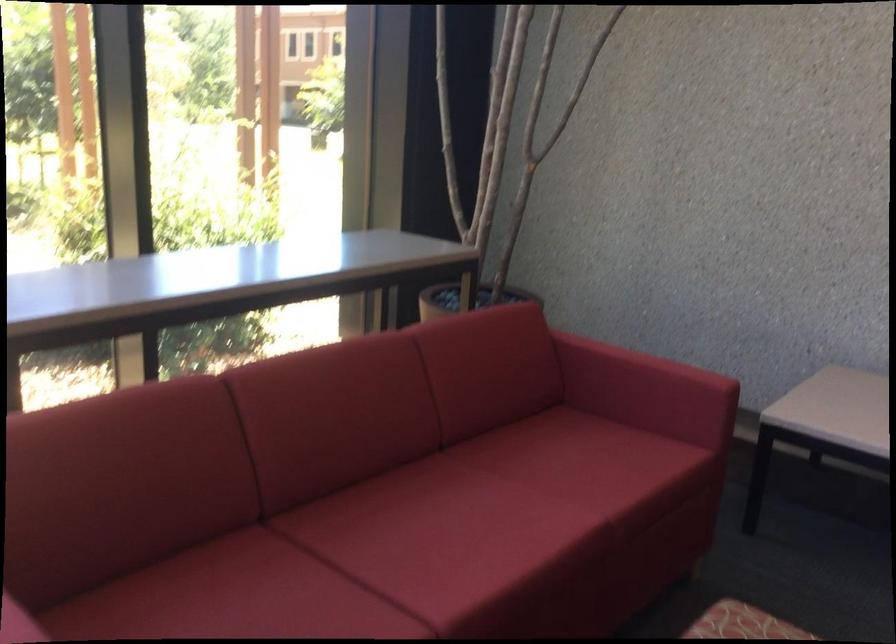
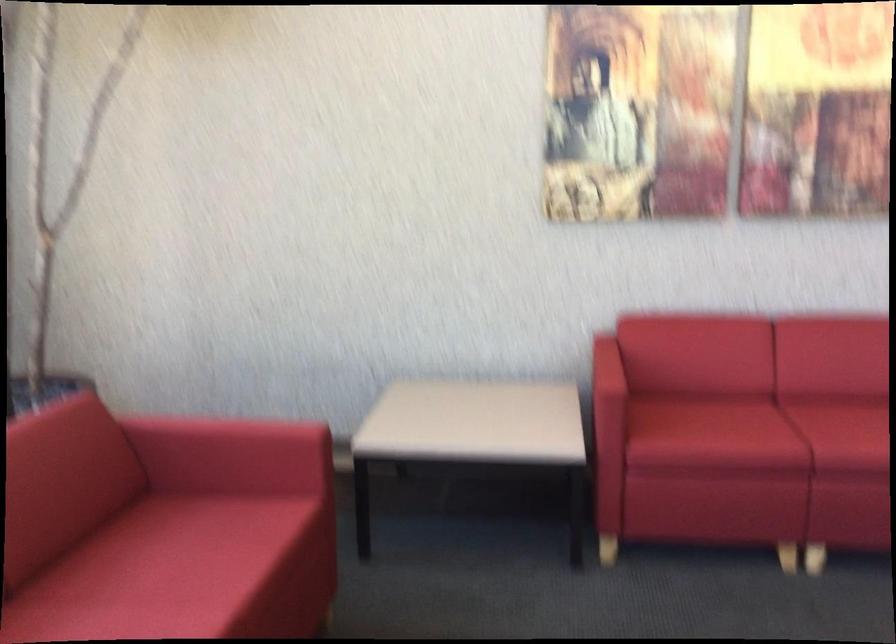
Where in the second image is the point corresponding to point (588, 456) from the first image?

(195, 547)